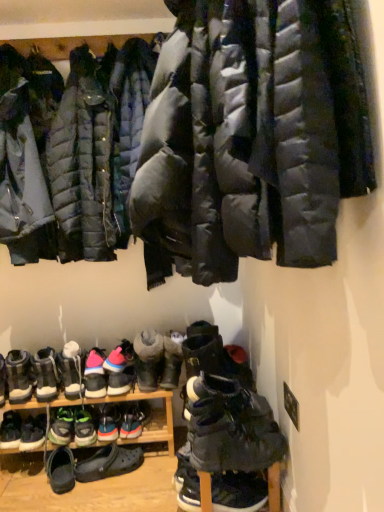
Find the location of a particular element. Image resolution: width=384 pixels, height=512 pixels. multicolored fabric sneaker at center, the tenth footwear when ordered from left to right is located at coordinates (132, 421).

This screenshot has width=384, height=512. Describe the element at coordinates (132, 421) in the screenshot. I see `multicolored fabric sneaker at center, the sixth footwear when ordered from right to left` at that location.

In order to click on black suede sneakers at lower left, the fifteenth footwear positioned from the right in this screenshot , I will do `click(19, 376)`.

You are a GUI agent. You are given a task and a screenshot of the screen. Output one action in this format:
    pyautogui.click(x=<x>, y=<y>)
    Task: Click on the matte black puffer jacket at upper left, acting as the 2th jacket starting from the front
    This screenshot has height=512, width=384.
    Given the screenshot: What is the action you would take?
    pos(70,151)

Measure the distance between point (100, 198) and camera.

5.60 feet.

This screenshot has width=384, height=512. Describe the element at coordinates (256, 133) in the screenshot. I see `matte black puffer jacket at upper center, acting as the first jacket starting from the front` at that location.

At what (x,y) coordinates should I click in order to perform the action: click on matte black puffer jacket at upper left, the 1th jacket viewed from the back. Please return your answer as a coordinate pair (x, y). The height and width of the screenshot is (512, 384). Looking at the image, I should click on (22, 167).

Measure the distance between point (38, 167) and camera.

Point (38, 167) and camera are 5.59 feet apart.

Where is `multicolored fabric sneaker at center, the tenth footwear when ordered from left to right`? Image resolution: width=384 pixels, height=512 pixels. multicolored fabric sneaker at center, the tenth footwear when ordered from left to right is located at coordinates (132, 421).

From a real-world perspective, is matte black puffer jacket at upper center, acting as the first jacket starting from the front, beneath multicolored suede sneakers at lower left, which is the twelfth footwear from right to left?

No.

Where is `the 4th footwear below the matte black puffer jacket at upper center, acting as the first jacket starting from the front (from a real-world perspective)`? Image resolution: width=384 pixels, height=512 pixels. the 4th footwear below the matte black puffer jacket at upper center, acting as the first jacket starting from the front (from a real-world perspective) is located at coordinates (71, 370).

Which of these two, matte black puffer jacket at upper center, which is the 3th jacket in back-to-front order, or multicolored suede sneakers at lower left, the fourth footwear in the left-to-right sequence, is wider?

matte black puffer jacket at upper center, which is the 3th jacket in back-to-front order, is wider.

Does matte black puffer jacket at upper center, acting as the first jacket starting from the front, have a larger size compared to multicolored suede sneakers at lower left, the fourth footwear in the left-to-right sequence?

Correct, matte black puffer jacket at upper center, acting as the first jacket starting from the front, is larger in size than multicolored suede sneakers at lower left, the fourth footwear in the left-to-right sequence.

Between gray suede boot at center, the 11th footwear viewed from the left, and matte black puffer jacket at upper left, the second jacket positioned from the back, which one appears on the left side from the viewer's perspective?

Positioned to the left is matte black puffer jacket at upper left, the second jacket positioned from the back.

Is gray suede boot at center, the 11th footwear viewed from the left, spatially inside matte black puffer jacket at upper left, the second jacket positioned from the back, or outside of it?

gray suede boot at center, the 11th footwear viewed from the left, cannot be found inside matte black puffer jacket at upper left, the second jacket positioned from the back.

Is gray suede boot at center, which ranks as the fifth footwear in right-to-left order, facing away from matte black puffer jacket at upper left, the second jacket positioned from the back?

That's not correct — gray suede boot at center, which ranks as the fifth footwear in right-to-left order, is not looking away from matte black puffer jacket at upper left, the second jacket positioned from the back.

From the image's perspective, which object appears higher, multicolored suede sneakers at lower left, the fourth footwear in the left-to-right sequence, or black suede boots at lower center, arranged as the 3th footwear when viewed from the right?

black suede boots at lower center, arranged as the 3th footwear when viewed from the right, from the image's perspective.

Measure the distance from multicolored suede sneakers at lower left, the fourth footwear in the left-to-right sequence, to black suede boots at lower center, the thirteenth footwear in the left-to-right sequence.

multicolored suede sneakers at lower left, the fourth footwear in the left-to-right sequence, and black suede boots at lower center, the thirteenth footwear in the left-to-right sequence, are 22.81 inches apart from each other.

Who is smaller, multicolored suede sneakers at lower left, which is the twelfth footwear from right to left, or black suede boots at lower center, arranged as the 3th footwear when viewed from the right?

multicolored suede sneakers at lower left, which is the twelfth footwear from right to left, is smaller.

Is matte black puffer jacket at upper center, acting as the first jacket starting from the front, positioned with its back to multicolored fabric sneaker at lower left, the 6th footwear viewed from the left?

No, matte black puffer jacket at upper center, acting as the first jacket starting from the front, is not facing the opposite direction of multicolored fabric sneaker at lower left, the 6th footwear viewed from the left.

Does matte black puffer jacket at upper center, acting as the first jacket starting from the front, touch multicolored fabric sneaker at lower left, the 6th footwear viewed from the left?

No.

Is matte black puffer jacket at upper center, which is the 3th jacket in back-to-front order, not within multicolored fabric sneaker at lower left, which appears as the 10th footwear when viewed from the right?

Absolutely, matte black puffer jacket at upper center, which is the 3th jacket in back-to-front order, is external to multicolored fabric sneaker at lower left, which appears as the 10th footwear when viewed from the right.

How many degrees apart are the facing directions of matte black puffer jacket at upper center, acting as the first jacket starting from the front, and multicolored fabric sneaker at lower left, which appears as the 10th footwear when viewed from the right?

The facing directions of matte black puffer jacket at upper center, acting as the first jacket starting from the front, and multicolored fabric sneaker at lower left, which appears as the 10th footwear when viewed from the right, are 96.9 degrees apart.

How much distance is there between multicolored suede sneakers at center, the ninth footwear in the right-to-left sequence, and matte black puffer jacket at upper center, which is the 3th jacket in back-to-front order?

multicolored suede sneakers at center, the ninth footwear in the right-to-left sequence, is 1.41 meters from matte black puffer jacket at upper center, which is the 3th jacket in back-to-front order.

Considering the relative sizes of multicolored suede sneakers at center, the seventh footwear in the left-to-right sequence, and matte black puffer jacket at upper center, acting as the first jacket starting from the front, in the image provided, is multicolored suede sneakers at center, the seventh footwear in the left-to-right sequence, smaller than matte black puffer jacket at upper center, acting as the first jacket starting from the front,?

Indeed, multicolored suede sneakers at center, the seventh footwear in the left-to-right sequence, has a smaller size compared to matte black puffer jacket at upper center, acting as the first jacket starting from the front.

Is multicolored suede sneakers at center, the seventh footwear in the left-to-right sequence, situated inside matte black puffer jacket at upper center, acting as the first jacket starting from the front, or outside?

multicolored suede sneakers at center, the seventh footwear in the left-to-right sequence, is outside matte black puffer jacket at upper center, acting as the first jacket starting from the front.

Does multicolored suede sneakers at center, the ninth footwear in the right-to-left sequence, lie in front of matte black puffer jacket at upper center, which is the 3th jacket in back-to-front order?

No, multicolored suede sneakers at center, the ninth footwear in the right-to-left sequence, is further to the viewer.

What's the angular difference between multicolored fabric sneaker at center, the sixth footwear when ordered from right to left, and multicolored suede sneakers at center, the ninth footwear in the right-to-left sequence,'s facing directions?

The angle between the facing direction of multicolored fabric sneaker at center, the sixth footwear when ordered from right to left, and the facing direction of multicolored suede sneakers at center, the ninth footwear in the right-to-left sequence, is 0.388 degrees.

Which point is more forward, (143, 418) or (110, 436)?

Positioned in front is point (110, 436).

Are multicolored fabric sneaker at center, the tenth footwear when ordered from left to right, and multicolored suede sneakers at center, the ninth footwear in the right-to-left sequence, located far from each other?

No.

Can you confirm if multicolored fabric sneaker at center, the tenth footwear when ordered from left to right, is thinner than multicolored suede sneakers at center, the ninth footwear in the right-to-left sequence?

In fact, multicolored fabric sneaker at center, the tenth footwear when ordered from left to right, might be wider than multicolored suede sneakers at center, the ninth footwear in the right-to-left sequence.

From a real-world perspective, which footwear is the 6th one underneath the matte black puffer jacket at upper left, the second jacket positioned from the back? Please provide its 2D coordinates.

[(19, 376)]

Is black suede sneakers at lower left, the fifteenth footwear positioned from the right, aimed at matte black puffer jacket at upper left, the second jacket positioned from the back?

No, black suede sneakers at lower left, the fifteenth footwear positioned from the right, is not oriented towards matte black puffer jacket at upper left, the second jacket positioned from the back.

Considering the sizes of black suede sneakers at lower left, the fifteenth footwear positioned from the right, and matte black puffer jacket at upper left, acting as the 2th jacket starting from the front, in the image, is black suede sneakers at lower left, the fifteenth footwear positioned from the right, wider or thinner than matte black puffer jacket at upper left, acting as the 2th jacket starting from the front,?

In the image, black suede sneakers at lower left, the fifteenth footwear positioned from the right, appears to be more narrow than matte black puffer jacket at upper left, acting as the 2th jacket starting from the front.

Choose the correct answer: Is black suede sneakers at lower left, which is counted as the first footwear, starting from the left, inside matte black puffer jacket at upper left, acting as the 2th jacket starting from the front, or outside it?

black suede sneakers at lower left, which is counted as the first footwear, starting from the left, is outside matte black puffer jacket at upper left, acting as the 2th jacket starting from the front.

The image size is (384, 512). Find the location of `the 4th footwear directly beneath the matte black puffer jacket at upper center, acting as the first jacket starting from the front (from a real-world perspective)`. the 4th footwear directly beneath the matte black puffer jacket at upper center, acting as the first jacket starting from the front (from a real-world perspective) is located at coordinates (71, 370).

The image size is (384, 512). Identify the location of the 1st jacket to the left of the gray suede boot at center, the 11th footwear viewed from the left, counting from the anchor's position. [x=70, y=151].

Looking at the image, which one is located further to multicolored fabric sneaker at center, the sixth footwear when ordered from right to left, dark gray suede boots at lower center, positioned as the first footwear in right-to-left order, or matte black puffer jacket at upper center, which is the 3th jacket in back-to-front order?

Among the two, matte black puffer jacket at upper center, which is the 3th jacket in back-to-front order, is located further to multicolored fabric sneaker at center, the sixth footwear when ordered from right to left.

Which object lies further to the anchor point multicolored fabric sneaker at lower left, the 6th footwear viewed from the left, black suede boot at lower left, the fourteenth footwear viewed from the right, or multicolored suede sneakers at lower left, which is the twelfth footwear from right to left?

Based on the image, black suede boot at lower left, the fourteenth footwear viewed from the right, appears to be further to multicolored fabric sneaker at lower left, the 6th footwear viewed from the left.

Which object lies nearer to the anchor point multicolored suede booties at center, placed as the 9th footwear when sorted from left to right, black suede boot at lower left, placed as the second footwear when sorted from left to right, or black suede boots at lower center, the thirteenth footwear in the left-to-right sequence?

The object closer to multicolored suede booties at center, placed as the 9th footwear when sorted from left to right, is black suede boot at lower left, placed as the second footwear when sorted from left to right.

Looking at the image, which one is located further to multicolored fabric sneaker at lower left, which appears as the 10th footwear when viewed from the right, green suede sneakers at lower left, the eleventh footwear when ordered from right to left, or dark gray suede boots at lower center, positioned as the first footwear in right-to-left order?

Based on the image, dark gray suede boots at lower center, positioned as the first footwear in right-to-left order, appears to be further to multicolored fabric sneaker at lower left, which appears as the 10th footwear when viewed from the right.

Consider the image. Considering their positions, is black suede sneakers at lower left, the fifteenth footwear positioned from the right, positioned further to matte black puffer jacket at upper center, acting as the first jacket starting from the front, than dark gray suede boot at lower center, which appears as the fourteenth footwear when viewed from the left?

black suede sneakers at lower left, the fifteenth footwear positioned from the right.

When comparing their distances from black suede boots at lower center, the thirteenth footwear in the left-to-right sequence, does multicolored fabric sneaker at center, the tenth footwear when ordered from left to right, or multicolored fabric sneaker at lower left, which appears as the 10th footwear when viewed from the right, seem further?

Among the two, multicolored fabric sneaker at lower left, which appears as the 10th footwear when viewed from the right, is located further to black suede boots at lower center, the thirteenth footwear in the left-to-right sequence.

Based on their spatial positions, is dark gray suede boot at lower center, the 2th footwear viewed from the right, or black suede boots at lower center, the thirteenth footwear in the left-to-right sequence, further from black suede boot at lower left, the fourteenth footwear viewed from the right?

dark gray suede boot at lower center, the 2th footwear viewed from the right, lies further to black suede boot at lower left, the fourteenth footwear viewed from the right, than the other object.

In the scene shown: Considering their positions, is multicolored suede booties at center, which appears as the seventh footwear when viewed from the right, positioned closer to black suede boots at lower center, the thirteenth footwear in the left-to-right sequence, than multicolored fabric sneaker at center, the tenth footwear when ordered from left to right?

multicolored suede booties at center, which appears as the seventh footwear when viewed from the right, lies closer to black suede boots at lower center, the thirteenth footwear in the left-to-right sequence, than the other object.

The width and height of the screenshot is (384, 512). Identify the location of footwear positioned between dark gray suede boots at lower center, positioned as the first footwear in right-to-left order, and black suede boots at lower center, arranged as the 3th footwear when viewed from the right, from near to far. point(238,492).

This screenshot has width=384, height=512. In order to click on jacket between matte black puffer jacket at upper left, the second jacket positioned from the back, and black rubber shoe at lower center, which is counted as the eighth footwear, starting from the left, from top to bottom in this screenshot , I will do `click(256, 133)`.

Image resolution: width=384 pixels, height=512 pixels. In order to click on footwear that lies between matte black puffer jacket at upper left, acting as the 2th jacket starting from the front, and black suede boots at lower center, the thirteenth footwear in the left-to-right sequence, from top to bottom in this screenshot , I will do `click(172, 360)`.

Locate an element on the screen. This screenshot has width=384, height=512. jacket between matte black puffer jacket at upper left, acting as the 2th jacket starting from the front, and dark gray suede boot at lower center, the 2th footwear viewed from the right, vertically is located at coordinates (256, 133).